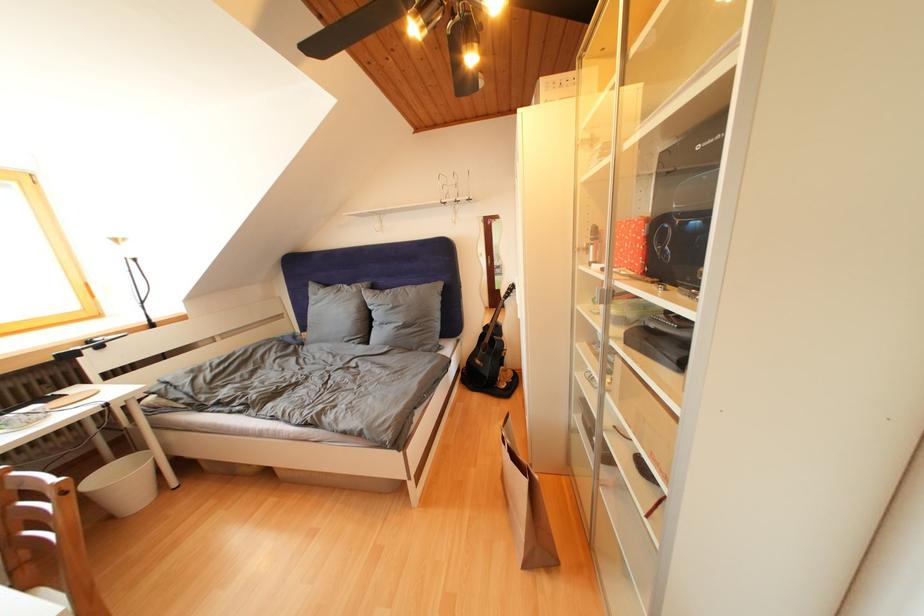
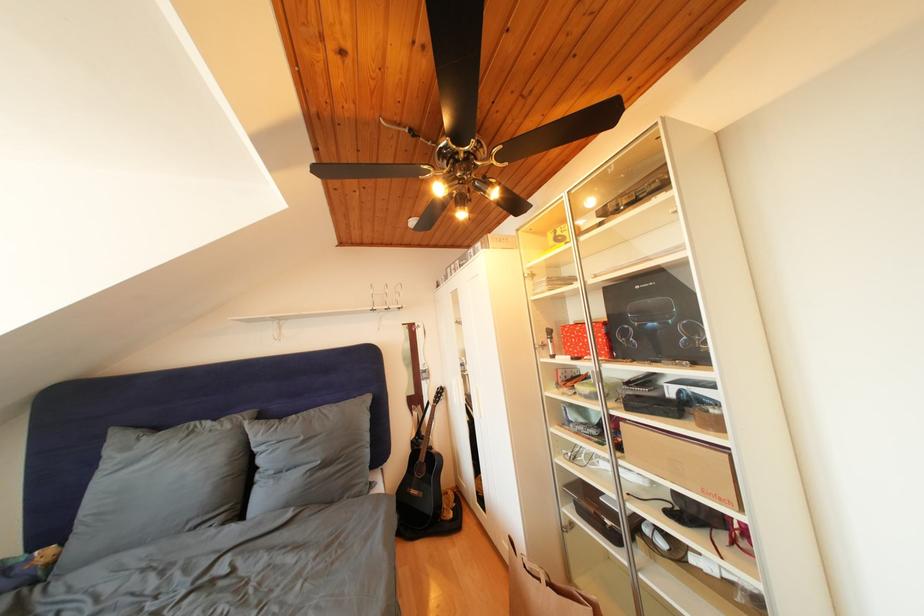
Question: I am providing you with two images of the same scene from different viewpoints. Which of the following objects are not visible in image2?

Choices:
 (A) fan pull chain
 (B) silver cabinet handle
 (C) brown cardboard box
 (D) none of these

Answer: (D)